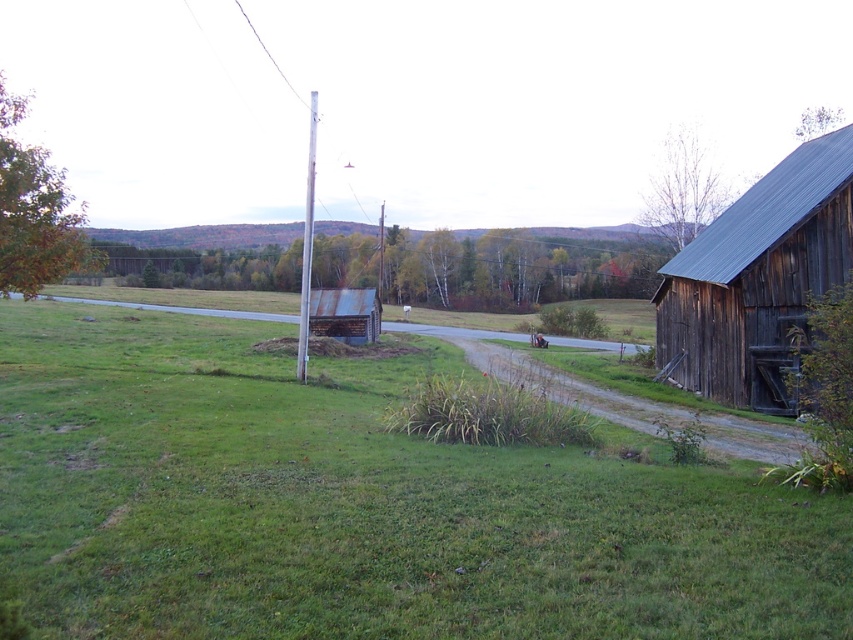
Can you confirm if green grass at center is positioned to the left of dark brown wooden barn at right?

Correct, you'll find green grass at center to the left of dark brown wooden barn at right.

Does green grass at center lie in front of dark brown wooden barn at right?

Yes, green grass at center is in front of dark brown wooden barn at right.

Is point (90, 552) farther from camera compared to point (749, 193)?

No, (90, 552) is closer to viewer.

Where is `green grass at center`? green grass at center is located at coordinates (360, 506).